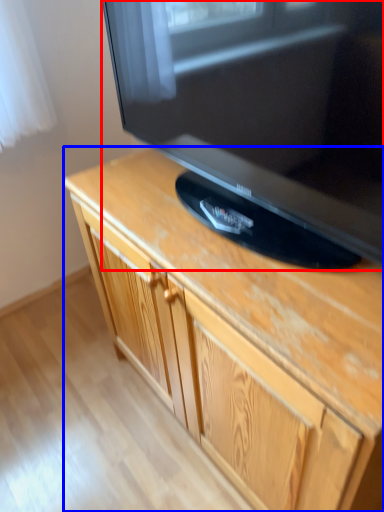
Question: Which object appears farthest to the camera in this image, television (highlighted by a red box) or cabinetry (highlighted by a blue box)?

Choices:
 (A) television
 (B) cabinetry

Answer: (B)